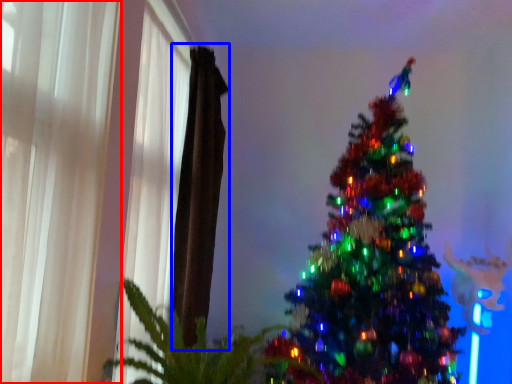
Question: Which point is closer to the camera, curtain (highlighted by a red box) or curtain (highlighted by a blue box)?

Choices:
 (A) curtain
 (B) curtain

Answer: (A)